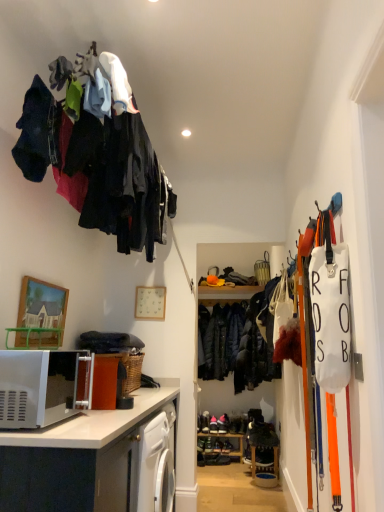
Question: Is dark blue fabric at upper left, positioned as the 2th clothing in bottom-to-top order, oriented towards dark brown leather shoes at center, which is the 1th footwear in left-to-right order?

Choices:
 (A) no
 (B) yes

Answer: (A)

Question: Is dark blue fabric at upper left, acting as the 1th clothing starting from the top, thinner than dark brown leather shoes at center, which is the 1th footwear in left-to-right order?

Choices:
 (A) yes
 (B) no

Answer: (B)

Question: Does dark blue fabric at upper left, positioned as the first clothing in front-to-back order, have a larger size compared to dark brown leather shoes at center, which is the 1th footwear in left-to-right order?

Choices:
 (A) no
 (B) yes

Answer: (B)

Question: Does dark blue fabric at upper left, placed as the 2th clothing when sorted from right to left, lie in front of dark brown leather shoes at center, which is the 1th footwear in left-to-right order?

Choices:
 (A) yes
 (B) no

Answer: (A)

Question: Does dark blue fabric at upper left, the 2th clothing in the back-to-front sequence, have a greater width compared to dark brown leather shoes at center, which ranks as the 2th footwear in right-to-left order?

Choices:
 (A) no
 (B) yes

Answer: (B)

Question: Is dark blue fabric at upper left, the 2th clothing in the back-to-front sequence, positioned far away from dark brown leather shoes at center, which ranks as the 2th footwear in right-to-left order?

Choices:
 (A) yes
 (B) no

Answer: (A)

Question: Is wooden picture frame at upper left closer to camera compared to dark brown leather shoes at center, which ranks as the 2th footwear in right-to-left order?

Choices:
 (A) yes
 (B) no

Answer: (A)

Question: Considering the relative positions of wooden picture frame at upper left and dark brown leather shoes at center, which is the 1th footwear in left-to-right order, in the image provided, is wooden picture frame at upper left to the right of dark brown leather shoes at center, which is the 1th footwear in left-to-right order, from the viewer's perspective?

Choices:
 (A) no
 (B) yes

Answer: (A)

Question: From the image's perspective, would you say wooden picture frame at upper left is shown under dark brown leather shoes at center, which is the 1th footwear in left-to-right order?

Choices:
 (A) yes
 (B) no

Answer: (B)

Question: Considering the relative sizes of wooden picture frame at upper left and dark brown leather shoes at center, which is the 1th footwear in left-to-right order, in the image provided, is wooden picture frame at upper left wider than dark brown leather shoes at center, which is the 1th footwear in left-to-right order,?

Choices:
 (A) yes
 (B) no

Answer: (B)

Question: Can you confirm if wooden picture frame at upper left is bigger than dark brown leather shoes at center, which is the 1th footwear in left-to-right order?

Choices:
 (A) no
 (B) yes

Answer: (B)

Question: From the image's perspective, is wooden picture frame at upper left over dark brown leather shoes at center, which ranks as the 2th footwear in right-to-left order?

Choices:
 (A) no
 (B) yes

Answer: (B)

Question: Is wooden picture frame at upper left wider than black leather shoes at center, positioned as the 2th footwear in left-to-right order?

Choices:
 (A) no
 (B) yes

Answer: (A)